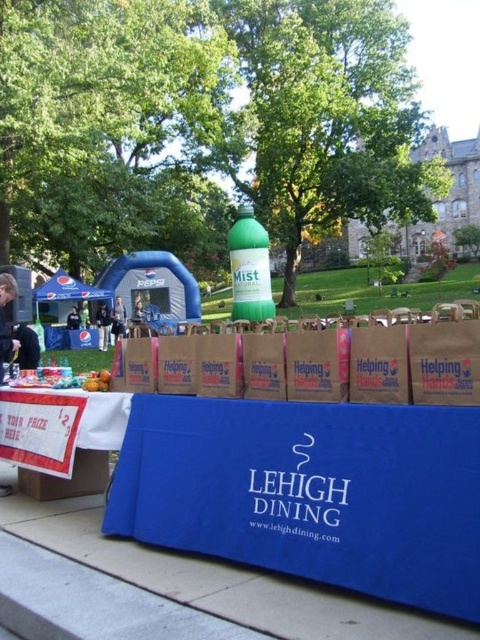
Question: Where is white paper banner at lower left located in relation to green matte bottle at center in the image?

Choices:
 (A) above
 (B) below

Answer: (B)

Question: Which point is farther to the camera?

Choices:
 (A) dark blue jeans at center
 (B) white paper banner at lower left
 (C) matte black jacket at lower left
 (D) blue fabric table at center

Answer: (A)

Question: Which object is closer to the camera taking this photo?

Choices:
 (A) green matte bottle at center
 (B) dark blue jeans at center
 (C) matte black jacket at center

Answer: (B)

Question: Does blue fabric table at center appear on the right side of black shirt at left?

Choices:
 (A) no
 (B) yes

Answer: (B)

Question: Is blue fabric table at center wider than matte black jacket at lower left?

Choices:
 (A) no
 (B) yes

Answer: (B)

Question: Estimate the real-world distances between objects in this image. Which object is closer to the matte black jacket at lower left?

Choices:
 (A) matte black jacket at center
 (B) green matte bottle at center

Answer: (A)